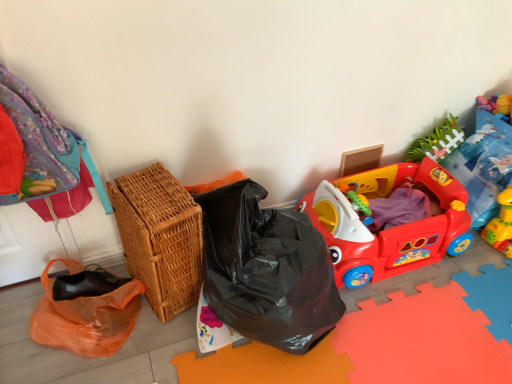
Question: Should I look upward or downward to see woven brown basket at left?

Choices:
 (A) down
 (B) up

Answer: (A)

Question: Is yellow rubber duck at lower right, the 2th toy from the left, a part of rubberized plastic play car at right, which is the second toy from right to left?

Choices:
 (A) yes
 (B) no

Answer: (B)

Question: Is rubberized plastic play car at right, which is the second toy from right to left, positioned behind yellow rubber duck at lower right, arranged as the first toy when viewed from the right?

Choices:
 (A) yes
 (B) no

Answer: (B)

Question: Is rubberized plastic play car at right, the first toy when ordered from left to right, shorter than yellow rubber duck at lower right, arranged as the first toy when viewed from the right?

Choices:
 (A) yes
 (B) no

Answer: (B)

Question: Can you confirm if rubberized plastic play car at right, the first toy when ordered from left to right, is positioned to the left of yellow rubber duck at lower right, the 2th toy from the left?

Choices:
 (A) no
 (B) yes

Answer: (B)

Question: Can you see rubberized plastic play car at right, the first toy when ordered from left to right, touching yellow rubber duck at lower right, arranged as the first toy when viewed from the right?

Choices:
 (A) no
 (B) yes

Answer: (A)

Question: Is rubberized plastic play car at right, which is the second toy from right to left, outside yellow rubber duck at lower right, arranged as the first toy when viewed from the right?

Choices:
 (A) yes
 (B) no

Answer: (A)

Question: From a real-world perspective, is rubberized plastic play car at right, which is the second toy from right to left, positioned over woven brown basket at left based on gravity?

Choices:
 (A) no
 (B) yes

Answer: (A)

Question: Could you tell me if rubberized plastic play car at right, the first toy when ordered from left to right, is turned towards woven brown basket at left?

Choices:
 (A) yes
 (B) no

Answer: (B)

Question: Are rubberized plastic play car at right, which is the second toy from right to left, and woven brown basket at left making contact?

Choices:
 (A) yes
 (B) no

Answer: (B)

Question: Does rubberized plastic play car at right, which is the second toy from right to left, have a larger size compared to woven brown basket at left?

Choices:
 (A) yes
 (B) no

Answer: (A)

Question: Is rubberized plastic play car at right, which is the second toy from right to left, to the right of woven brown basket at left from the viewer's perspective?

Choices:
 (A) yes
 (B) no

Answer: (A)

Question: Is rubberized plastic play car at right, the first toy when ordered from left to right, shorter than woven brown basket at left?

Choices:
 (A) no
 (B) yes

Answer: (B)

Question: Is the position of woven brown basket at left less distant than that of matte cardboard box at upper right?

Choices:
 (A) yes
 (B) no

Answer: (A)